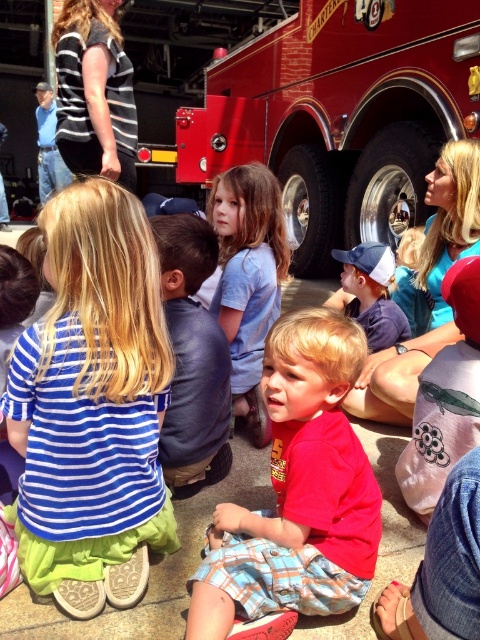
The height and width of the screenshot is (640, 480). Describe the element at coordinates (298, 490) in the screenshot. I see `red cotton shirt at center` at that location.

Is red cotton shirt at center smaller than leather jacket at center?

No.

Between point (324, 554) and point (204, 236), which one is positioned in front?

Point (324, 554) is in front.

You are a GUI agent. You are given a task and a screenshot of the screen. Output one action in this format:
    pyautogui.click(x=<x>, y=<y>)
    Task: Click on the red cotton shirt at center
    This screenshot has width=480, height=640.
    Given the screenshot: What is the action you would take?
    pyautogui.click(x=298, y=490)

Is blue striped shirt at center above shiny red fire truck at center?

No, blue striped shirt at center is not above shiny red fire truck at center.

Does blue striped shirt at center lie in front of shiny red fire truck at center?

That is True.

Is point (116, 330) closer to viewer compared to point (478, 29)?

That is True.

Where is `blue striped shirt at center`? This screenshot has height=640, width=480. blue striped shirt at center is located at coordinates (93, 404).

Between blue striped shirt at center and light blue cotton shirt at center, which one has more height?

light blue cotton shirt at center is taller.

Does blue striped shirt at center appear on the right side of light blue cotton shirt at center?

No, blue striped shirt at center is not to the right of light blue cotton shirt at center.

Measure the distance between blue striped shirt at center and camera.

blue striped shirt at center is 1.71 meters away from camera.

In order to click on blue striped shirt at center in this screenshot , I will do point(93,404).